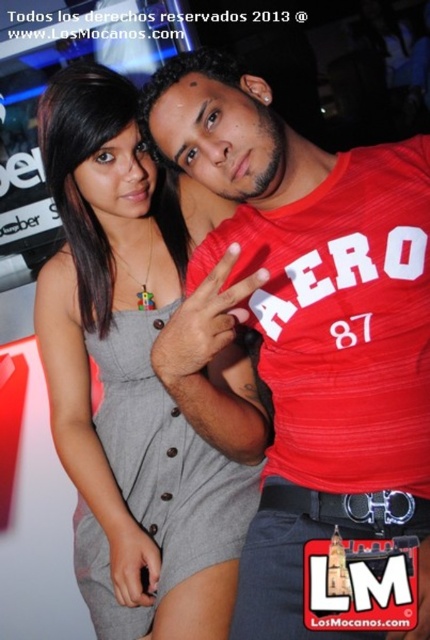
Question: Which object appears farthest from the camera in this image?

Choices:
 (A) red cotton t-shirt at center
 (B) gray fabric dress at center

Answer: (A)

Question: Can you confirm if red cotton t-shirt at center is bigger than gray fabric dress at center?

Choices:
 (A) yes
 (B) no

Answer: (B)

Question: Among these points, which one is nearest to the camera?

Choices:
 (A) (82, 227)
 (B) (169, 77)

Answer: (B)

Question: Does red cotton t-shirt at center appear on the left side of gray fabric dress at center?

Choices:
 (A) no
 (B) yes

Answer: (A)

Question: Does red cotton t-shirt at center appear on the right side of gray fabric dress at center?

Choices:
 (A) yes
 (B) no

Answer: (A)